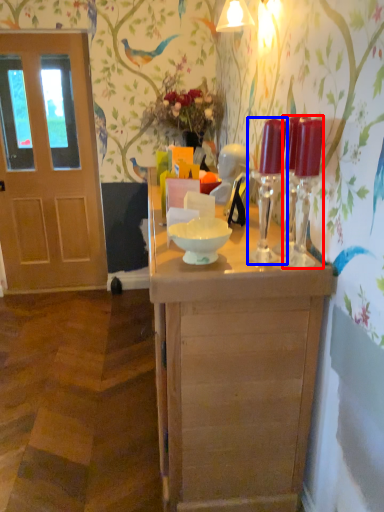
Question: Which of the following is the farthest to the observer, candle holder (highlighted by a red box) or candle holder (highlighted by a blue box)?

Choices:
 (A) candle holder
 (B) candle holder

Answer: (B)